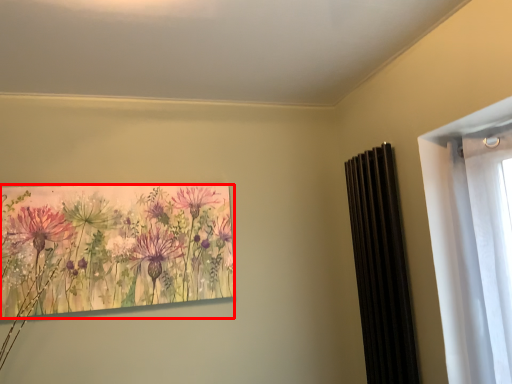
Question: From the image, what is the correct spatial relationship of flower (annotated by the red box) in relation to radiator?

Choices:
 (A) left
 (B) right

Answer: (A)